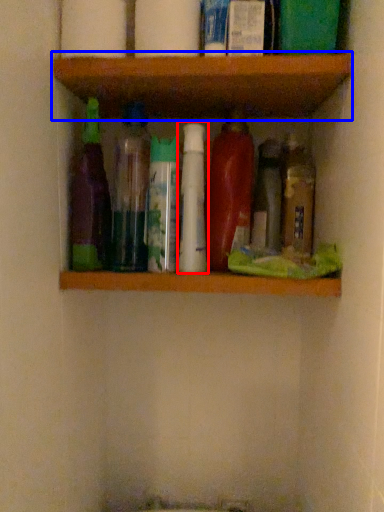
Question: Which point is further to the camera, bottle (highlighted by a red box) or shelf (highlighted by a blue box)?

Choices:
 (A) bottle
 (B) shelf

Answer: (A)